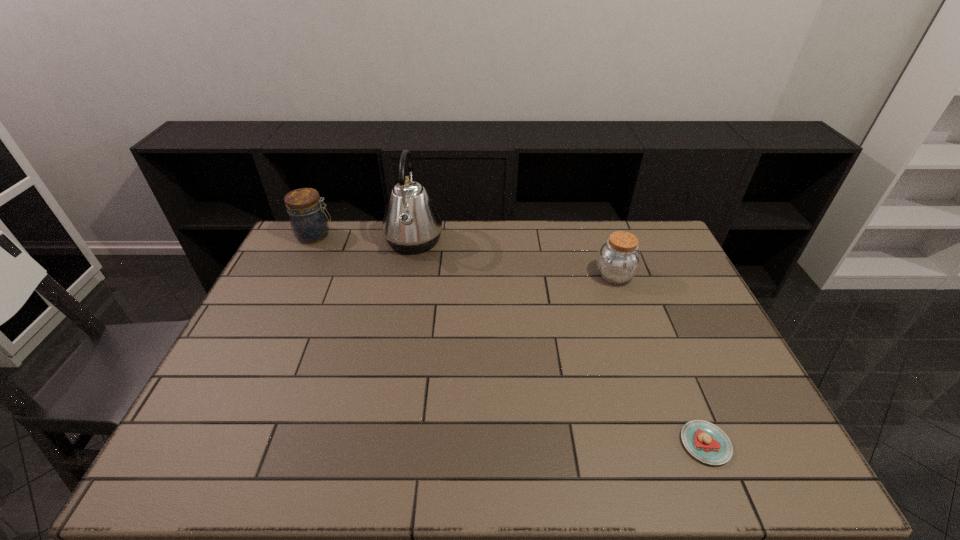
Find the location of a particular element. This screenshot has height=540, width=960. free space at the near edge of the desktop is located at coordinates (469, 456).

Locate an element on the screen. blank area at the left edge is located at coordinates (277, 295).

Where is `free region at the right edge`? free region at the right edge is located at coordinates (756, 426).

Locate an element on the screen. free space at the far right corner is located at coordinates 673,260.

This screenshot has height=540, width=960. What are the coordinates of `unoccupied position between the left jar and the nearest object` in the screenshot? It's located at (510, 340).

The height and width of the screenshot is (540, 960). I want to click on vacant area that lies between the tallest object and the right jar, so click(x=515, y=258).

Locate an element on the screen. Image resolution: width=960 pixels, height=540 pixels. vacant space that's between the left jar and the shortest object is located at coordinates (510, 340).

Find the location of `empty location between the leftmost object and the nearest object`. empty location between the leftmost object and the nearest object is located at coordinates (510, 340).

Identify the location of empty location between the shortest object and the right jar. The height and width of the screenshot is (540, 960). (660, 360).

Find the location of `free space between the pastry and the third object from right to left`. free space between the pastry and the third object from right to left is located at coordinates (560, 342).